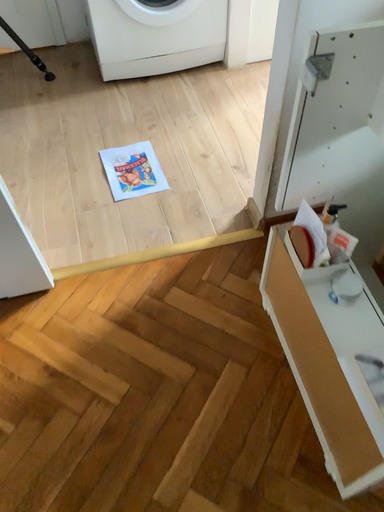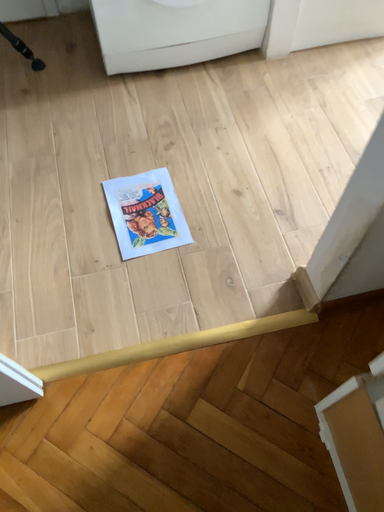
Question: How did the camera likely rotate when shooting the video?

Choices:
 (A) rotated upward
 (B) rotated downward

Answer: (B)